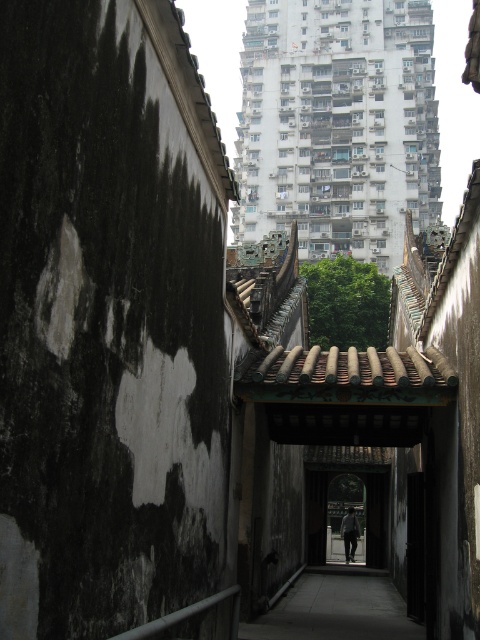
Question: Is smooth concrete path at center in front of dark gray fabric at center?

Choices:
 (A) yes
 (B) no

Answer: (A)

Question: Can you confirm if smooth concrete path at center is positioned below dark gray fabric at center?

Choices:
 (A) yes
 (B) no

Answer: (B)

Question: Which point is farther to the camera?

Choices:
 (A) (345, 522)
 (B) (313, 621)

Answer: (A)

Question: Is smooth concrete path at center further to the viewer compared to dark gray fabric at center?

Choices:
 (A) yes
 (B) no

Answer: (B)

Question: Which of the following is the farthest from the observer?

Choices:
 (A) (331, 596)
 (B) (355, 516)

Answer: (B)

Question: Which of the following is the closest to the observer?

Choices:
 (A) dark gray fabric at center
 (B) smooth concrete path at center

Answer: (B)